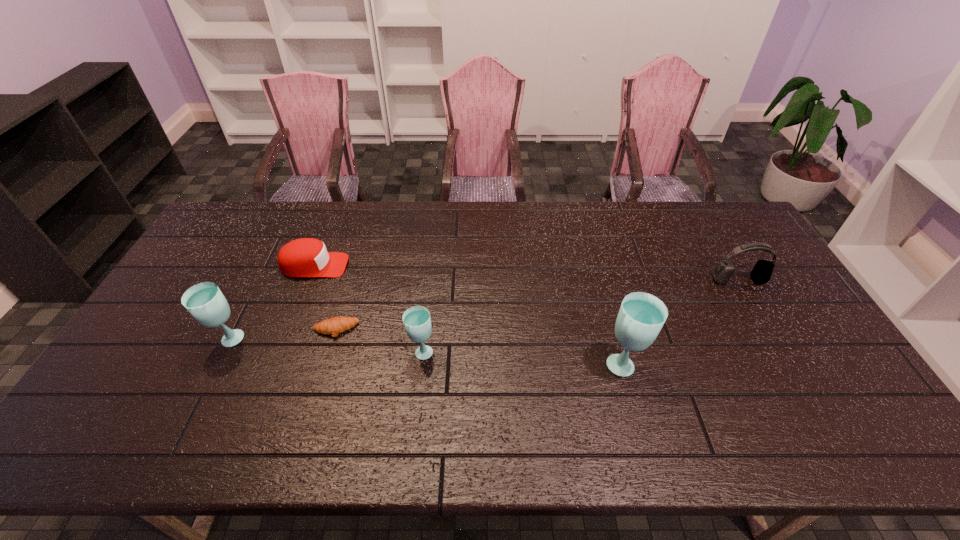
Where is `free region at the far left corner of the desktop`? free region at the far left corner of the desktop is located at coordinates (248, 216).

Where is `vacant point located between the second shortest object and the second glass from left to right`? The height and width of the screenshot is (540, 960). vacant point located between the second shortest object and the second glass from left to right is located at coordinates (368, 308).

Where is `vacant space that is in between the third object from right to left and the crescent roll`? This screenshot has height=540, width=960. vacant space that is in between the third object from right to left and the crescent roll is located at coordinates (378, 341).

What are the coordinates of `empty space between the headset and the third object from right to left` in the screenshot? It's located at (580, 316).

You are a GUI agent. You are given a task and a screenshot of the screen. Output one action in this format:
    pyautogui.click(x=<x>, y=<y>)
    Task: Click on the free spot between the headset and the baseball cap
    The height and width of the screenshot is (540, 960).
    Given the screenshot: What is the action you would take?
    [526, 273]

The width and height of the screenshot is (960, 540). I want to click on vacant area that lies between the second glass from right to left and the crescent roll, so click(378, 341).

In order to click on vacant space that is in between the shortest glass and the tallest glass in this screenshot , I will do `click(522, 357)`.

At what (x,y) coordinates should I click in order to perform the action: click on blank region between the crescent roll and the second glass from left to right. Please return your answer as a coordinate pair (x, y). The width and height of the screenshot is (960, 540). Looking at the image, I should click on (378, 341).

This screenshot has width=960, height=540. In order to click on empty space between the tallest glass and the second glass from left to right in this screenshot , I will do `click(522, 357)`.

The height and width of the screenshot is (540, 960). I want to click on free space between the shortest glass and the second tallest glass, so click(x=325, y=346).